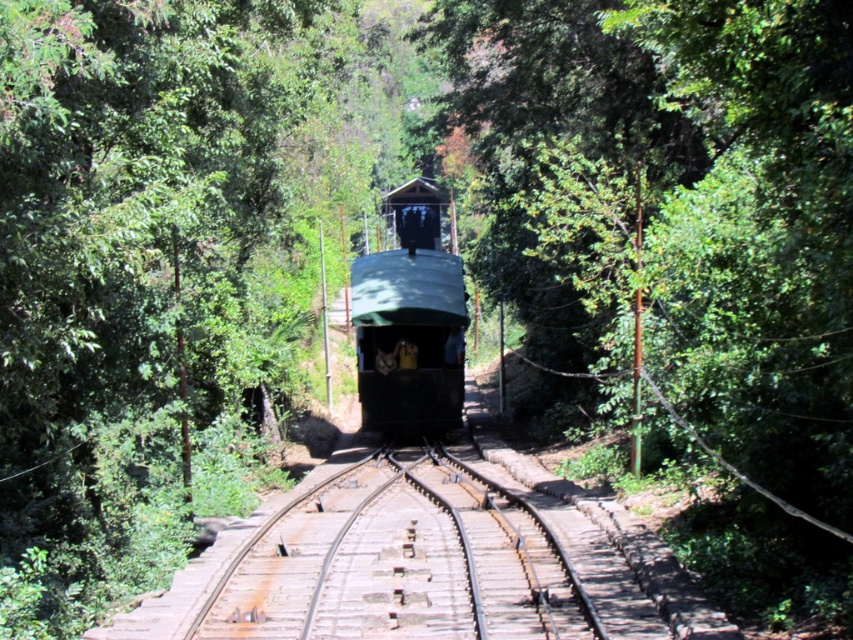
You are a maintenance worker needing to inspect the rusty metal train track at center and the green matte train at center. Which object is positioned lower in the scene?

The rusty metal train track at center is located below the green matte train at center, so it is positioned lower in the scene.

You are a railway inspector checking the track conditions. You notice the rusty metal train track at center and the green matte train at center. Which object is wider?

The rusty metal train track at center is wider than the green matte train at center.